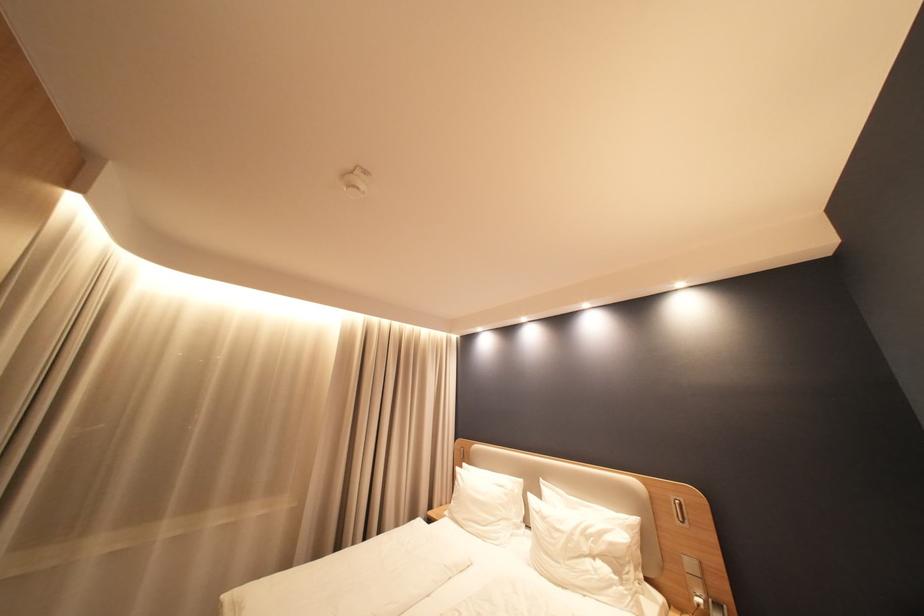
Identify the location of USB power port. (698, 610).